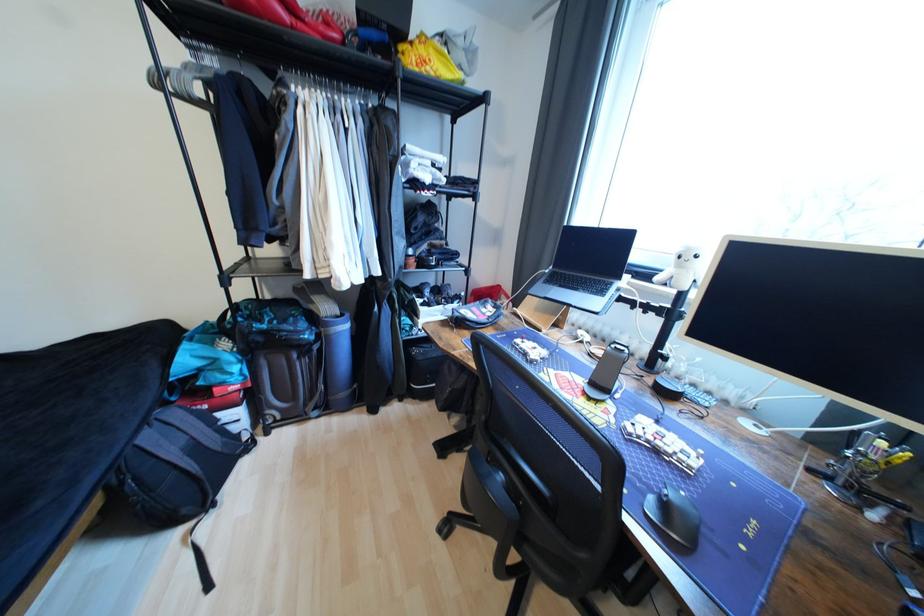
This screenshot has width=924, height=616. What are the coordinates of `black smart speaker` in the screenshot? It's located at (667, 387).